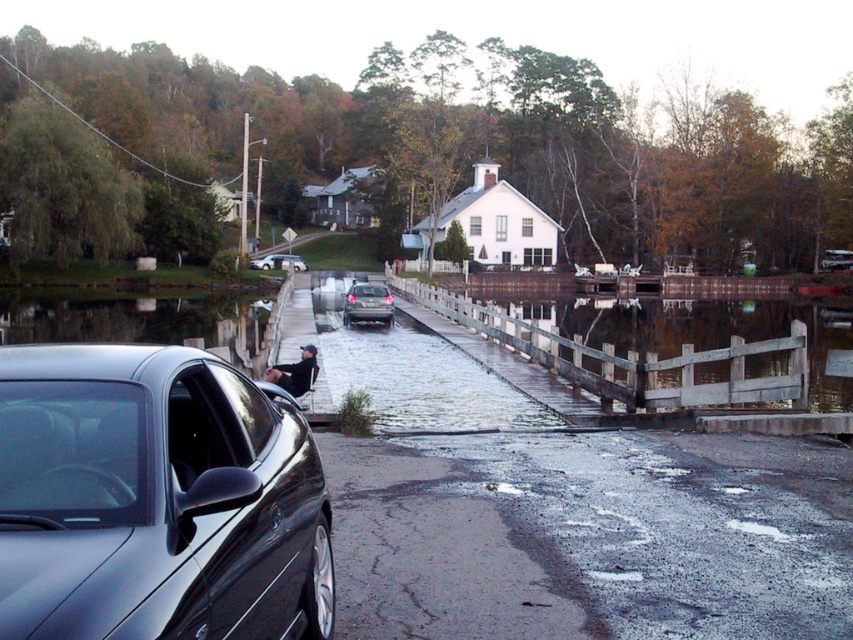
You are a delivery driver who needs to cross the bridge but your vehicle has a 12 meter turning radius. Based on the scene, can you safely navigate the turn at the wooden fence at center and slick asphalt flood at center?

The wooden fence at center is 12.02 meters from the slick asphalt flood at center. Since your vehicle requires a 12 meter turning radius, the distance between them allows for a safe turn.